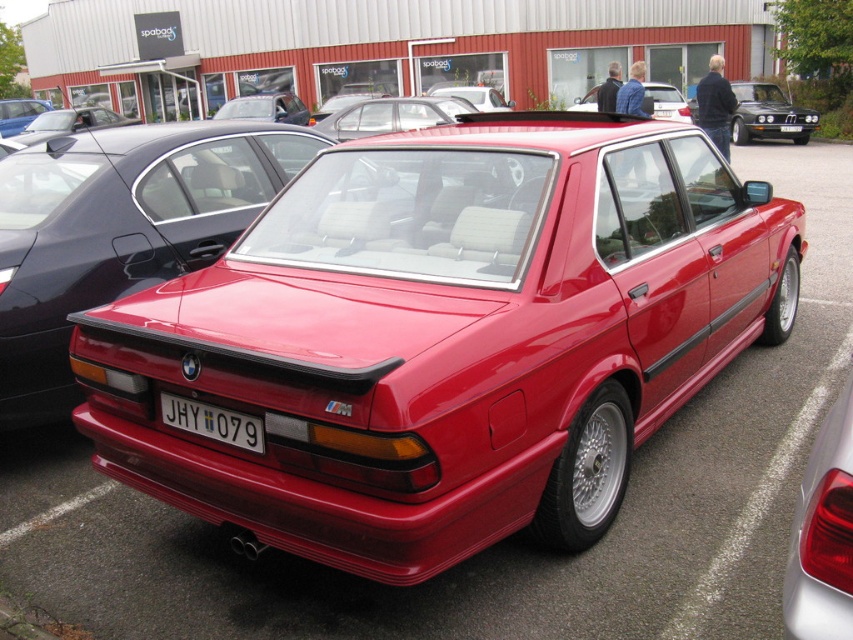
You are a photographer standing in the parking lot and want to take a photo of both the glossy black sedan at upper right and the glossy metallic car at upper left. Which car should you focus on first to ensure it appears sharp in the photo?

You should focus on the glossy black sedan at upper right first because it is closer to you than the glossy metallic car at upper left, so focusing on the closer object ensures it will be sharp while the background car may be slightly blurred.

You are a parking attendant and need to fit a new car into the parking space between the two sedans. The new car is 1.8 meters wide. Can you determine if there is enough space between the glossy black sedan at upper right and the glossy red sedan at center?

The glossy black sedan at upper right has a lesser width compared to the glossy red sedan at center. Since the black sedan is narrower, the space between them might be sufficient for the new car. However, without knowing the exact distance between the cars, it is impossible to confirm if the 1.8 meters width will fit. Please measure the available space.

You are a parking attendant and need to verify the license plate of the glossy red sedan at center. From your perspective standing in front of the car, where would you look to find the white plastic license plate at center?

The white plastic license plate at center is positioned on the left side of the glossy red sedan at center, so you should look on the left side of the car to find it.